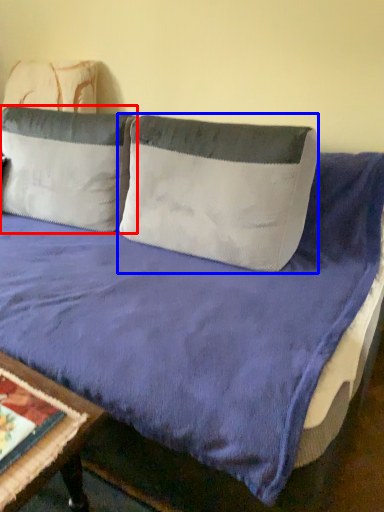
Question: Which of the following is the farthest to the observer, pillow (highlighted by a red box) or pillow (highlighted by a blue box)?

Choices:
 (A) pillow
 (B) pillow

Answer: (A)